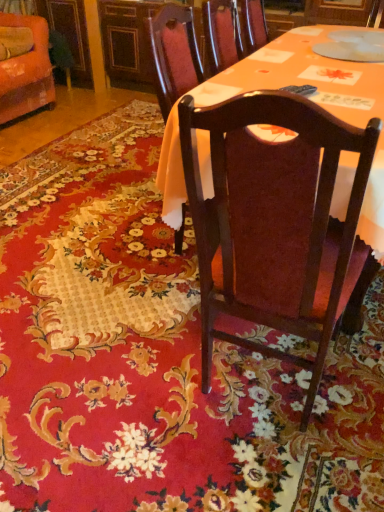
Question: Considering the relative sizes of orange fabric chair at upper left, acting as the second chair starting from the bottom, and matte wood table at center in the image provided, is orange fabric chair at upper left, acting as the second chair starting from the bottom, shorter than matte wood table at center?

Choices:
 (A) yes
 (B) no

Answer: (A)

Question: Considering the relative positions of orange fabric chair at upper left, which ranks as the 2th chair in right-to-left order, and matte wood table at center in the image provided, is orange fabric chair at upper left, which ranks as the 2th chair in right-to-left order, to the right of matte wood table at center from the viewer's perspective?

Choices:
 (A) no
 (B) yes

Answer: (A)

Question: Can you confirm if orange fabric chair at upper left, which is the 1th chair from back to front, is taller than matte wood table at center?

Choices:
 (A) no
 (B) yes

Answer: (A)

Question: From the image's perspective, is orange fabric chair at upper left, acting as the second chair starting from the bottom, on matte wood table at center?

Choices:
 (A) yes
 (B) no

Answer: (A)

Question: From the image's perspective, is orange fabric chair at upper left, which is the 1th chair from back to front, located beneath matte wood table at center?

Choices:
 (A) no
 (B) yes

Answer: (A)

Question: Is orange fabric chair at upper left, which appears as the 1th chair when viewed from the top, further to camera compared to matte wood table at center?

Choices:
 (A) yes
 (B) no

Answer: (A)

Question: Does dark wood chair at center, which is counted as the 1th chair, starting from the bottom, have a lesser width compared to orange fabric chair at upper left, which is the 1th chair from back to front?

Choices:
 (A) no
 (B) yes

Answer: (A)

Question: Can you confirm if dark wood chair at center, the second chair from the top, is positioned to the right of orange fabric chair at upper left, acting as the second chair starting from the bottom?

Choices:
 (A) yes
 (B) no

Answer: (A)

Question: From the image's perspective, is dark wood chair at center, the second chair from the top, located above orange fabric chair at upper left, which ranks as the 2th chair in front-to-back order?

Choices:
 (A) no
 (B) yes

Answer: (A)

Question: From a real-world perspective, is dark wood chair at center, the second chair from the top, positioned under orange fabric chair at upper left, which ranks as the 2th chair in right-to-left order, based on gravity?

Choices:
 (A) yes
 (B) no

Answer: (B)

Question: Does dark wood chair at center, marked as the 2th chair in a back-to-front arrangement, contain orange fabric chair at upper left, which ranks as the 2th chair in right-to-left order?

Choices:
 (A) no
 (B) yes

Answer: (A)

Question: Can you confirm if dark wood chair at center, the 1th chair positioned from the front, is bigger than orange fabric chair at upper left, which is the 1th chair from back to front?

Choices:
 (A) yes
 (B) no

Answer: (A)

Question: Can you confirm if dark wood chair at center, acting as the second chair starting from the left, is thinner than matte wood table at center?

Choices:
 (A) yes
 (B) no

Answer: (B)